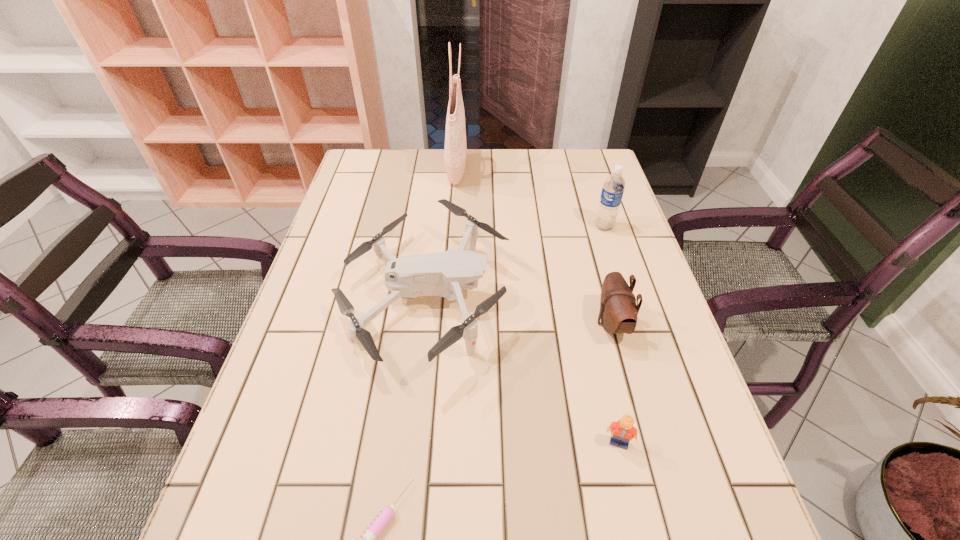
Identify the location of the farthest object. The height and width of the screenshot is (540, 960). (455, 150).

Find the location of a particular element. The height and width of the screenshot is (540, 960). shopping bag is located at coordinates (455, 150).

Image resolution: width=960 pixels, height=540 pixels. Identify the location of the fifth nearest object. (613, 188).

Find the location of a particular element. This screenshot has height=540, width=960. the second tallest object is located at coordinates (613, 188).

At what (x,y) coordinates should I click in order to perform the action: click on pouch. Please return your answer as a coordinate pair (x, y). The width and height of the screenshot is (960, 540). Looking at the image, I should click on click(618, 312).

You are a GUI agent. You are given a task and a screenshot of the screen. Output one action in this format:
    pyautogui.click(x=<x>, y=<y>)
    Task: Click on the drone
    The width and height of the screenshot is (960, 540).
    Given the screenshot: What is the action you would take?
    pyautogui.click(x=444, y=274)

Where is `the fifth farthest object`? the fifth farthest object is located at coordinates (623, 430).

Image resolution: width=960 pixels, height=540 pixels. In order to click on Lego in this screenshot , I will do `click(623, 430)`.

You are a GUI agent. You are given a task and a screenshot of the screen. Output one action in this format:
    pyautogui.click(x=<x>, y=<y>)
    Task: Click on the vacant space located 0.170m on the right of the shopping bag
    The width and height of the screenshot is (960, 540).
    Given the screenshot: What is the action you would take?
    pyautogui.click(x=519, y=171)

At what (x,y) coordinates should I click in order to perform the action: click on blank area located 0.070m on the left of the water bottle. Please return your answer as a coordinate pair (x, y). Looking at the image, I should click on (569, 226).